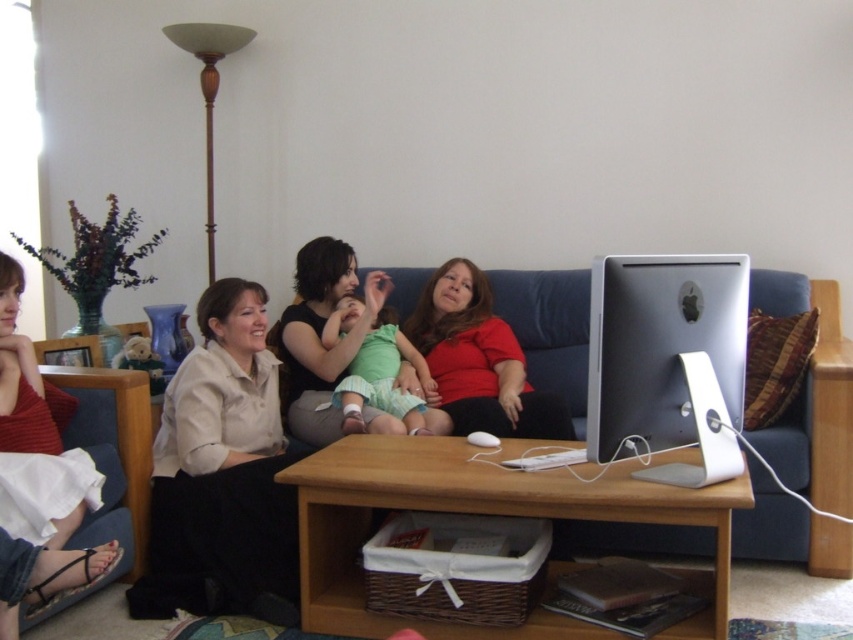
Question: Among these objects, which one is nearest to the camera?

Choices:
 (A) matte black shirt at center
 (B) matte red shirt at center
 (C) sleek silver monitor at center

Answer: (C)

Question: Which object is positioned farthest from the sleek silver monitor at center?

Choices:
 (A) matte red shirt at center
 (B) matte black shirt at center
 (C) white matte shirt at center

Answer: (C)

Question: Does white matte shirt at center appear under matte black shirt at center?

Choices:
 (A) yes
 (B) no

Answer: (A)

Question: Which point is farther to the camera?

Choices:
 (A) white matte shirt at center
 (B) sleek silver monitor at center
 (C) matte black shirt at center

Answer: (C)

Question: Is white matte shirt at center to the left of matte red shirt at center from the viewer's perspective?

Choices:
 (A) yes
 (B) no

Answer: (A)

Question: Does sleek silver monitor at center appear on the left side of matte red shirt at center?

Choices:
 (A) no
 (B) yes

Answer: (A)